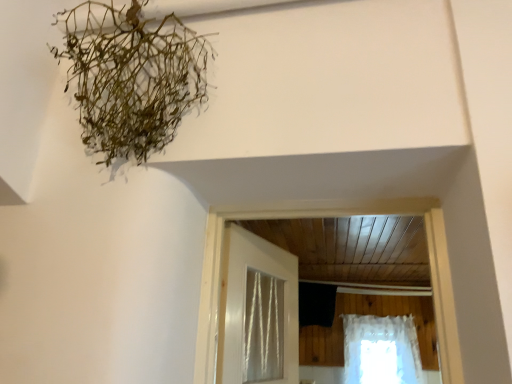
Question: From the image's perspective, relative to green fibrous plant at upper left, is white glossy door at center above or below?

Choices:
 (A) above
 (B) below

Answer: (B)

Question: Is white glossy door at center in front of or behind green fibrous plant at upper left in the image?

Choices:
 (A) behind
 (B) front

Answer: (A)

Question: Estimate the real-world distances between objects in this image. Which object is closer to the white glossy door at center?

Choices:
 (A) green fibrous plant at upper left
 (B) white lace curtain at lower right

Answer: (A)

Question: Estimate the real-world distances between objects in this image. Which object is closer to the white lace curtain at lower right?

Choices:
 (A) white glossy door at center
 (B) green fibrous plant at upper left

Answer: (A)